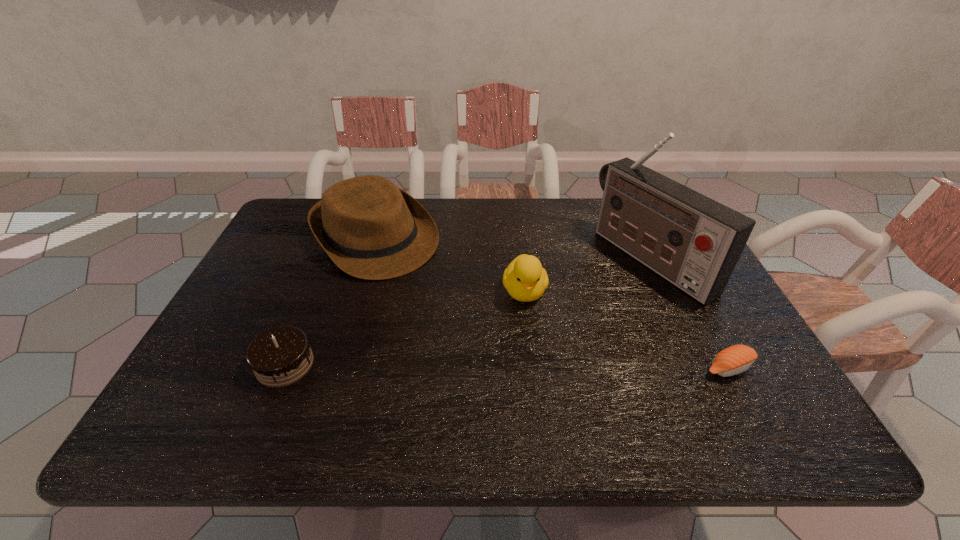
Locate an element on the screen. Image resolution: width=960 pixels, height=540 pixels. chocolate cake at the left edge is located at coordinates (280, 356).

Locate an element on the screen. The width and height of the screenshot is (960, 540). fedora present at the left edge is located at coordinates (370, 229).

Locate an element on the screen. sushi that is at the right edge is located at coordinates (736, 359).

In order to click on radio receiver located at the right edge in this screenshot , I will do (x=694, y=242).

Find the location of a particular element. Image resolution: width=960 pixels, height=540 pixels. object located at the far left corner is located at coordinates (370, 229).

At what (x,y) coordinates should I click in order to perform the action: click on object at the near left corner. Please return your answer as a coordinate pair (x, y). This screenshot has height=540, width=960. Looking at the image, I should click on (280, 356).

The image size is (960, 540). I want to click on object that is at the far right corner, so click(694, 242).

Find the location of a particular element. Image resolution: width=960 pixels, height=540 pixels. object at the near right corner is located at coordinates (736, 359).

Locate an element on the screen. vacant space at the far edge is located at coordinates (503, 211).

At what (x,y) coordinates should I click in order to perform the action: click on vacant space at the left edge of the desktop. Please return your answer as a coordinate pair (x, y). The height and width of the screenshot is (540, 960). Looking at the image, I should click on (293, 243).